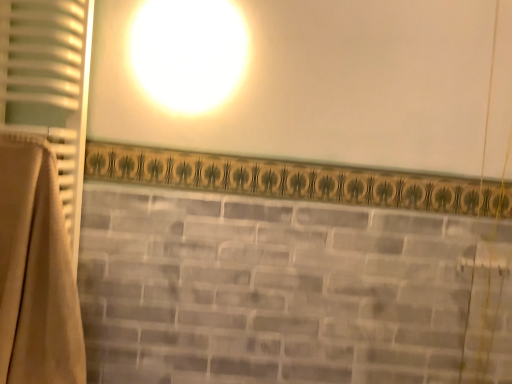
Question: Considering the positions of point (74, 329) and point (16, 6), is point (74, 329) closer or farther from the camera than point (16, 6)?

Choices:
 (A) closer
 (B) farther

Answer: (A)

Question: From the image's perspective, relative to beige fabric curtain at left, which appears as the first curtain when viewed from the top, is beige fabric curtain at left, which is the first curtain from bottom to top, above or below?

Choices:
 (A) below
 (B) above

Answer: (A)

Question: Would you say beige fabric curtain at left, which is the first curtain from bottom to top, is inside or outside beige fabric curtain at left, which appears as the first curtain when viewed from the top?

Choices:
 (A) inside
 (B) outside

Answer: (B)

Question: Choose the correct answer: Is beige fabric curtain at left, which appears as the first curtain when viewed from the top, inside beige fabric curtain at left, which appears as the 2th curtain when viewed from the top, or outside it?

Choices:
 (A) inside
 (B) outside

Answer: (B)

Question: From a real-world perspective, is beige fabric curtain at left, which appears as the first curtain when viewed from the top, above or below beige fabric curtain at left, which is the first curtain from bottom to top?

Choices:
 (A) above
 (B) below

Answer: (A)

Question: In terms of size, does beige fabric curtain at left, the 2th curtain when ordered from bottom to top, appear bigger or smaller than beige fabric curtain at left, which appears as the 2th curtain when viewed from the top?

Choices:
 (A) big
 (B) small

Answer: (B)

Question: From the image's perspective, relative to beige fabric curtain at left, which appears as the 2th curtain when viewed from the top, is beige fabric curtain at left, the 2th curtain when ordered from bottom to top, above or below?

Choices:
 (A) above
 (B) below

Answer: (A)